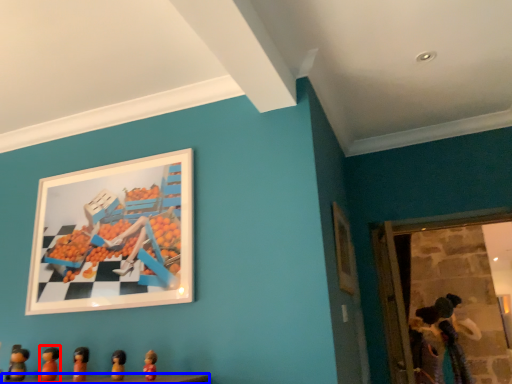
Question: Which point is closer to the camera, toy (highlighted by a red box) or table (highlighted by a blue box)?

Choices:
 (A) toy
 (B) table

Answer: (B)